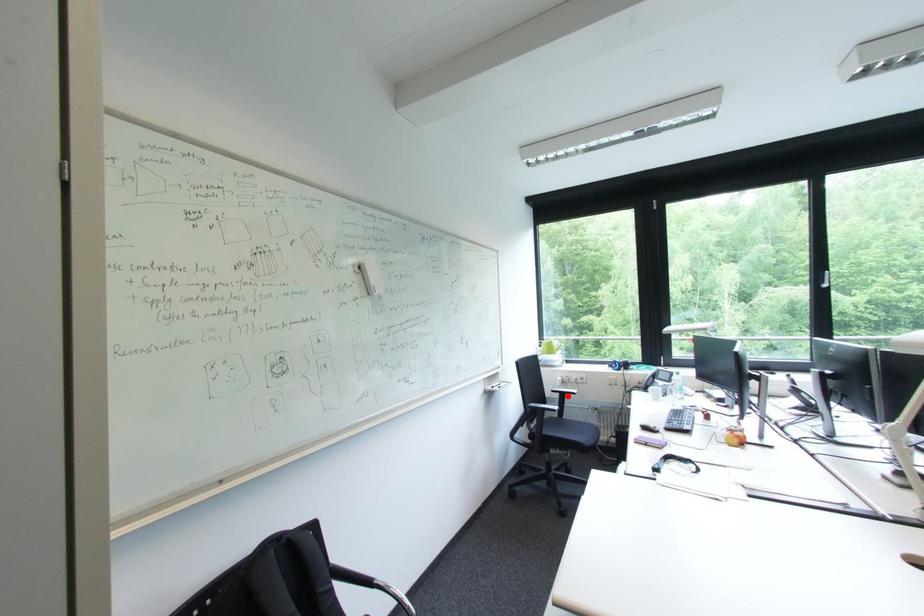
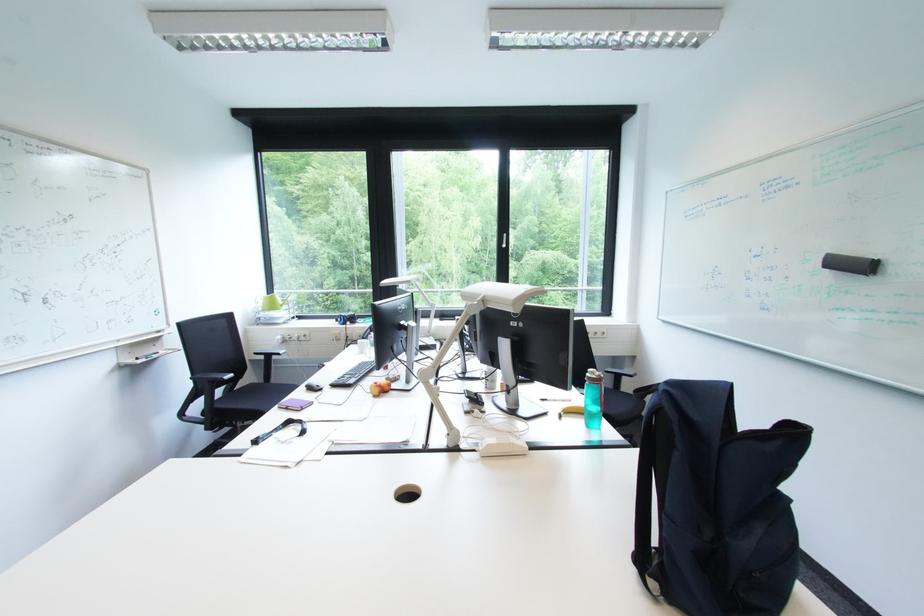
Where in the second image is the point corresponding to the highlighted location from the first image?

(273, 358)